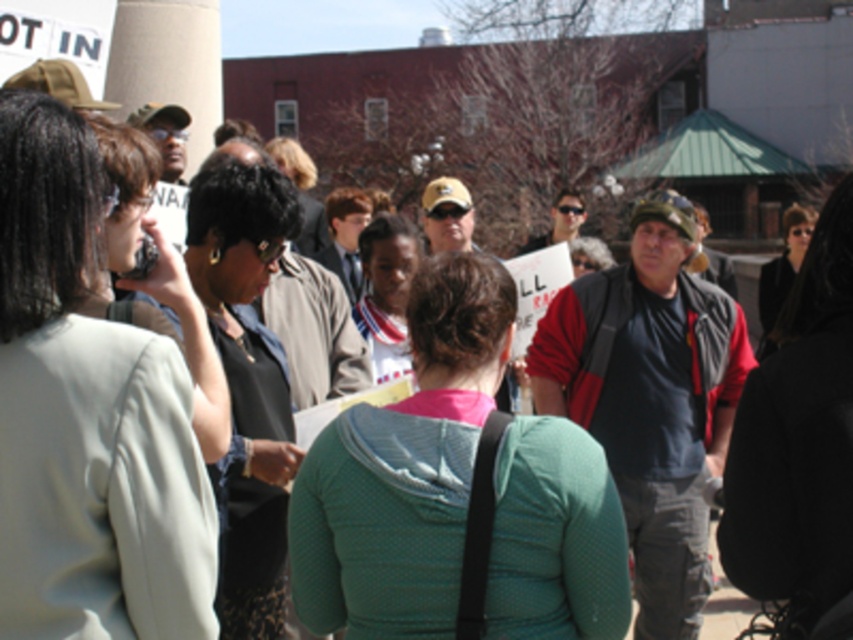
Question: Which object appears closest to the camera in this image?

Choices:
 (A) matte black shirt at center
 (B) black fabric jacket at center
 (C) light beige jacket at left
 (D) green textured sweater at center

Answer: (C)

Question: Estimate the real-world distances between objects in this image. Which object is closer to the matte fabric jacket at center?

Choices:
 (A) light beige jacket at left
 (B) black fabric jacket at center
 (C) matte black shirt at center
 (D) green textured sweater at center

Answer: (C)

Question: Which point is closer to the camera taking this photo?

Choices:
 (A) (384, 250)
 (B) (234, 262)

Answer: (B)

Question: Can you confirm if green textured sweater at center is positioned below black fabric jacket at center?

Choices:
 (A) yes
 (B) no

Answer: (A)

Question: Considering the relative positions of light beige jacket at left and black fabric jacket at center in the image provided, where is light beige jacket at left located with respect to black fabric jacket at center?

Choices:
 (A) below
 (B) above

Answer: (B)

Question: Does green textured sweater at center appear on the left side of matte fabric jacket at center?

Choices:
 (A) yes
 (B) no

Answer: (B)